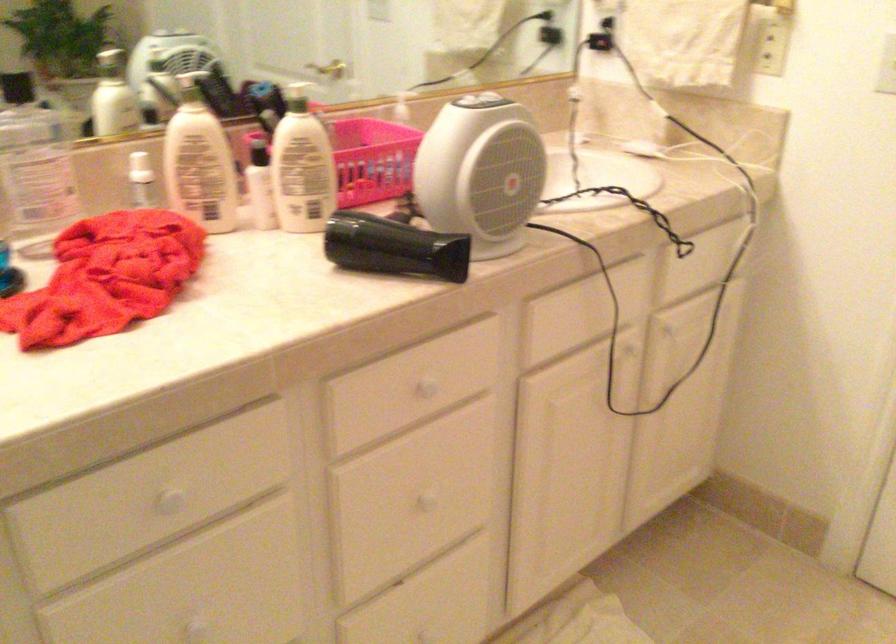
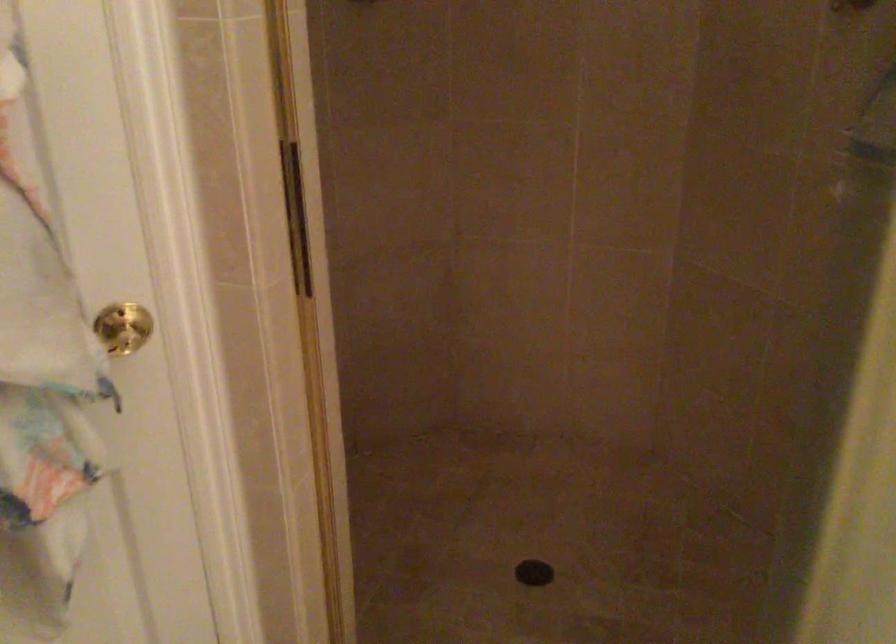
How did the camera likely rotate?

The camera's rotation is toward left-down.